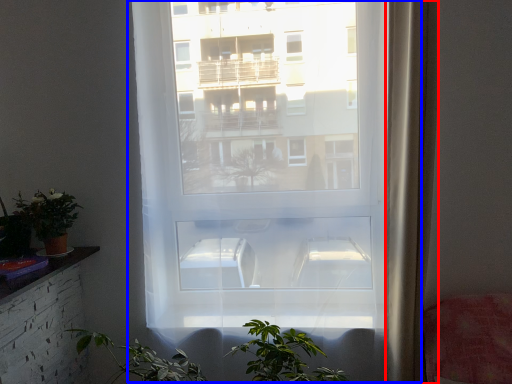
Question: Which object is further to the camera taking this photo, curtain (highlighted by a red box) or window (highlighted by a blue box)?

Choices:
 (A) curtain
 (B) window

Answer: (B)